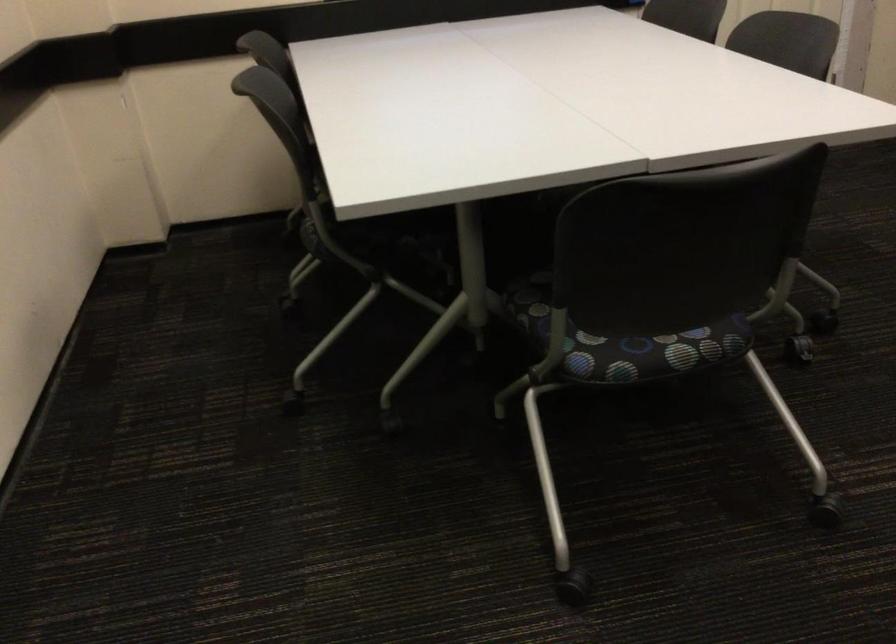
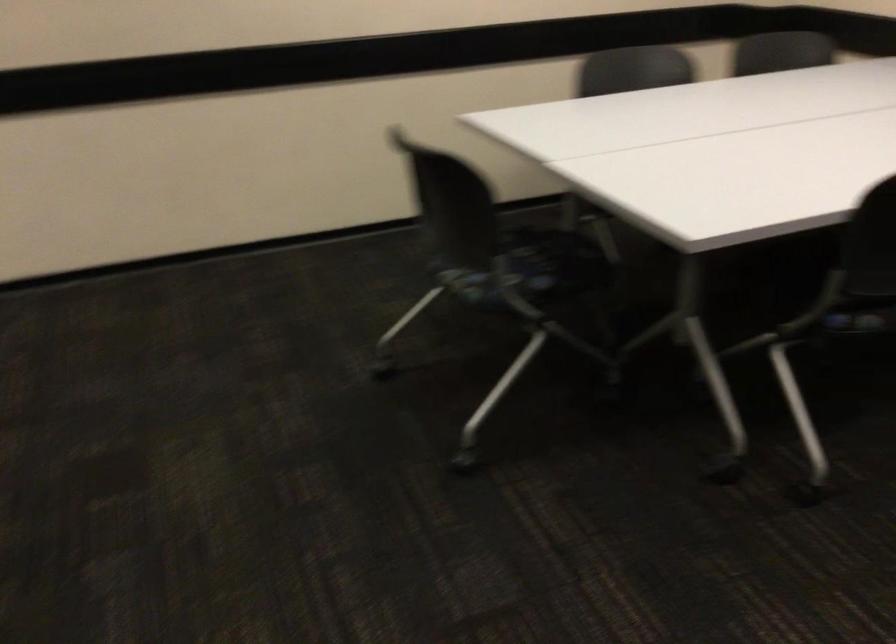
Find the pixel in the second image that matches pixel 696 327 in the first image.

(494, 285)